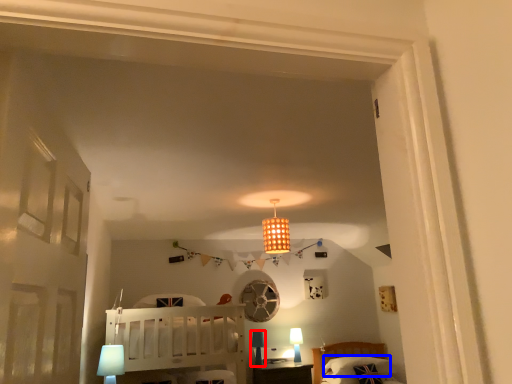
Question: Which of the following is the closest to the observer, table lamp (highlighted by a red box) or pillow (highlighted by a blue box)?

Choices:
 (A) table lamp
 (B) pillow

Answer: (A)